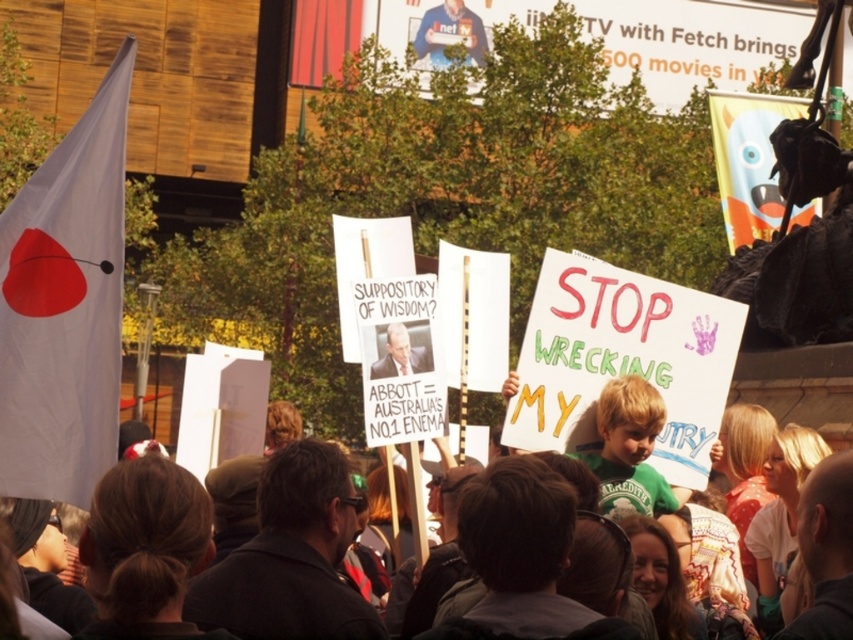
Question: Based on their relative distances, which object is nearer to the white fabric flag at left?

Choices:
 (A) blue shirt at upper center
 (B) smooth plastic sign at center

Answer: (B)

Question: Is blue shirt at upper center in front of smooth plastic sign at center?

Choices:
 (A) yes
 (B) no

Answer: (B)

Question: Which is nearer to the matte plastic flag at upper right?

Choices:
 (A) smooth plastic sign at center
 (B) blue shirt at upper center
 (C) white fabric flag at left

Answer: (B)

Question: Which is farther from the smooth plastic sign at center?

Choices:
 (A) blue shirt at upper center
 (B) matte plastic flag at upper right
 (C) white fabric flag at left

Answer: (A)

Question: Does blue shirt at upper center have a lesser width compared to smooth plastic sign at center?

Choices:
 (A) yes
 (B) no

Answer: (A)

Question: Can you confirm if white fabric flag at left is thinner than smooth plastic sign at center?

Choices:
 (A) yes
 (B) no

Answer: (B)